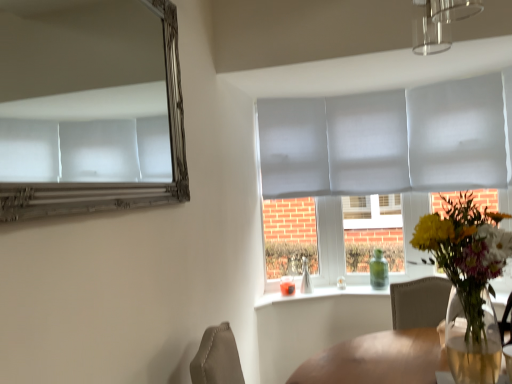
Question: Is green glass bottle at window a part of translucent glass vase at center?

Choices:
 (A) yes
 (B) no

Answer: (B)

Question: Does translucent glass vase at center have a larger size compared to green glass bottle at window?

Choices:
 (A) no
 (B) yes

Answer: (B)

Question: Can you confirm if translucent glass vase at center is taller than green glass bottle at window?

Choices:
 (A) no
 (B) yes

Answer: (B)

Question: Is translucent glass vase at center touching green glass bottle at window?

Choices:
 (A) no
 (B) yes

Answer: (A)

Question: Is there a large distance between translucent glass vase at center and green glass bottle at window?

Choices:
 (A) yes
 (B) no

Answer: (A)

Question: Does translucent glass vase at center have a lesser width compared to green glass bottle at window?

Choices:
 (A) yes
 (B) no

Answer: (B)

Question: From the image's perspective, would you say green glass bottle at window is shown under silver metallic mirror at upper left?

Choices:
 (A) no
 (B) yes

Answer: (B)

Question: Considering the relative sizes of green glass bottle at window and silver metallic mirror at upper left in the image provided, is green glass bottle at window smaller than silver metallic mirror at upper left?

Choices:
 (A) yes
 (B) no

Answer: (A)

Question: From a real-world perspective, is green glass bottle at window located beneath silver metallic mirror at upper left?

Choices:
 (A) no
 (B) yes

Answer: (B)

Question: Is green glass bottle at window far away from silver metallic mirror at upper left?

Choices:
 (A) no
 (B) yes

Answer: (B)

Question: Is the position of green glass bottle at window less distant than that of silver metallic mirror at upper left?

Choices:
 (A) no
 (B) yes

Answer: (A)

Question: Is green glass bottle at window facing towards silver metallic mirror at upper left?

Choices:
 (A) no
 (B) yes

Answer: (A)

Question: Considering the relative positions of silver metallic mirror at upper left and green glass bottle at window in the image provided, is silver metallic mirror at upper left to the left of green glass bottle at window from the viewer's perspective?

Choices:
 (A) no
 (B) yes

Answer: (B)